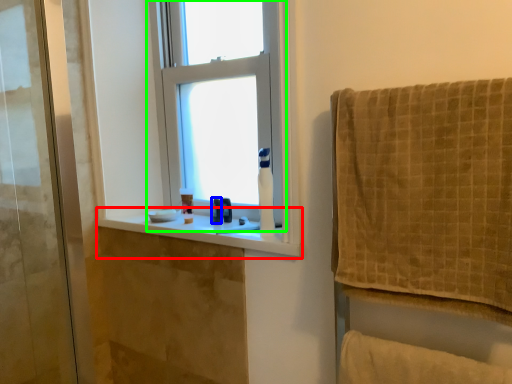
Question: Estimate the real-world distances between objects in this image. Which object is closer to window sill (highlighted by a red box), toiletry (highlighted by a blue box) or window (highlighted by a green box)?

Choices:
 (A) toiletry
 (B) window

Answer: (A)